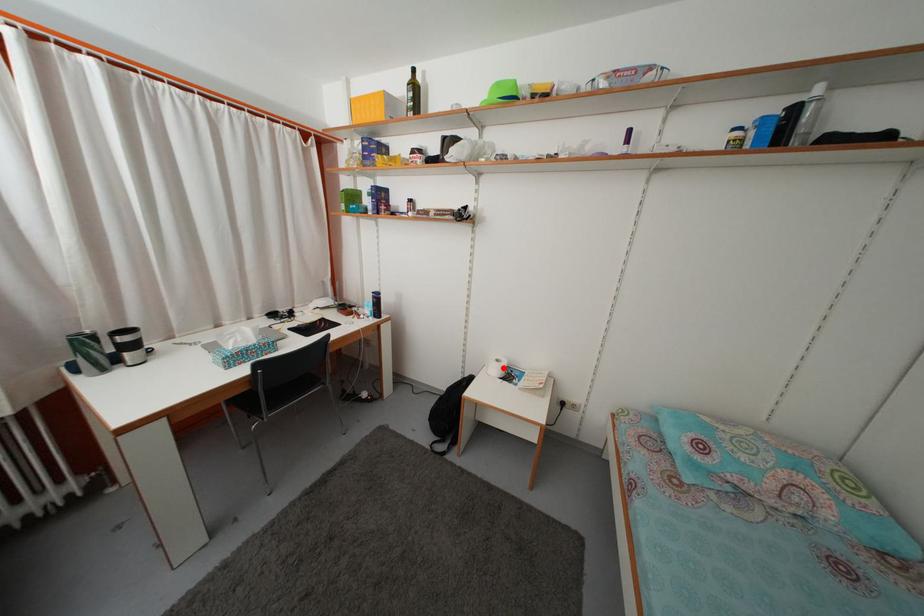
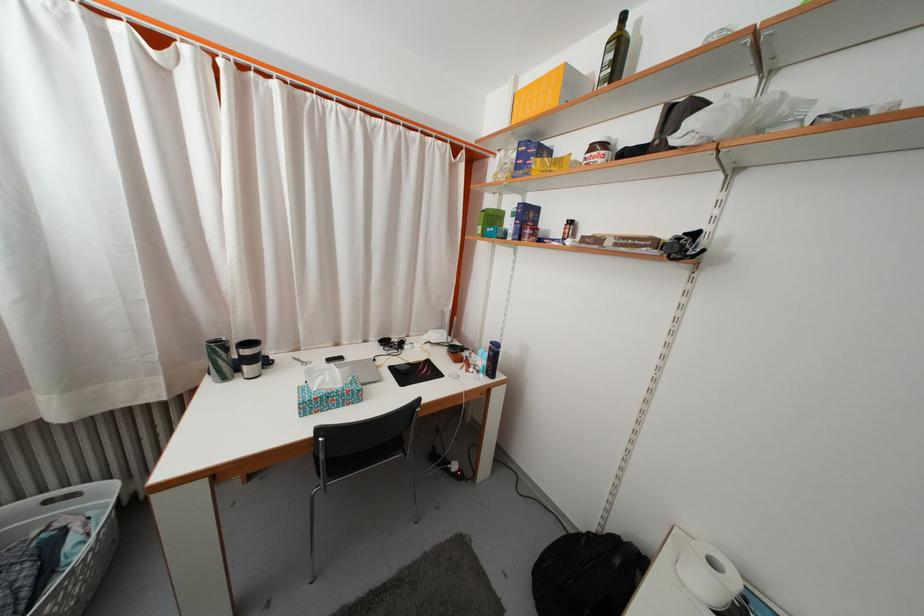
Question: I am providing you with two images of the same scene from different viewpoints. A red point is marked on the first image. At the location where the point appears in image 1, is it still visible in image 2?

Choices:
 (A) Yes
 (B) No

Answer: (A)